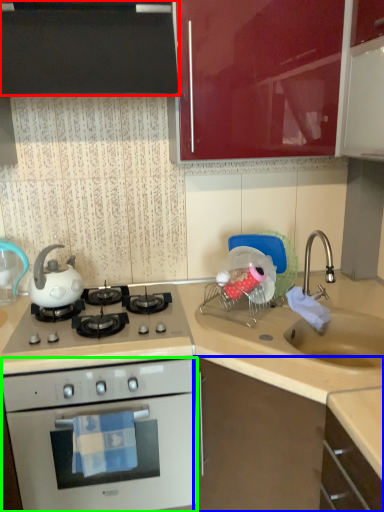
Question: Based on their relative distances, which object is nearer to cabinetry (highlighted by a red box)? Choose from cabinetry (highlighted by a blue box) and oven (highlighted by a green box).

Choices:
 (A) cabinetry
 (B) oven

Answer: (B)